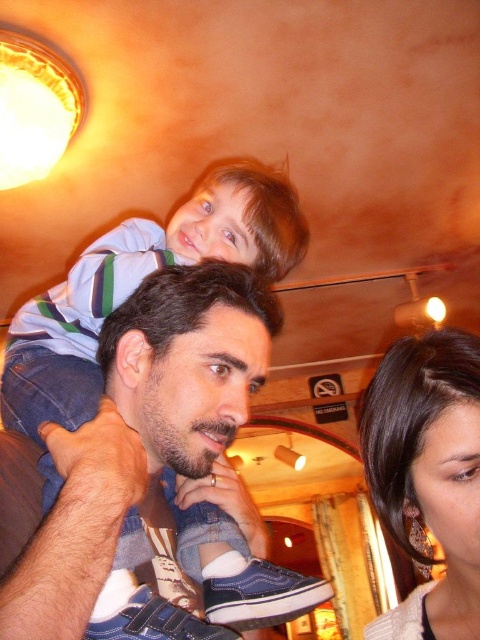
Which is above, dark brown hair at center or satin brown hair at upper right?

dark brown hair at center is higher up.

Based on the photo, is dark brown hair at center closer to the viewer compared to satin brown hair at upper right?

That is True.

Is point (173, 621) closer to camera compared to point (376, 500)?

Yes, it is.

You are a GUI agent. You are given a task and a screenshot of the screen. Output one action in this format:
    pyautogui.click(x=<x>, y=<y>)
    Task: Click on the dark brown hair at center
    
    Given the screenshot: What is the action you would take?
    pyautogui.click(x=189, y=358)